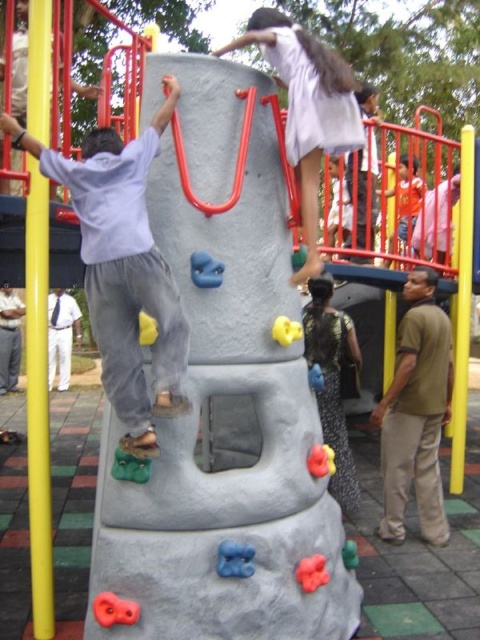
Question: Estimate the real-world distances between objects in this image. Which object is farther from the matte gray climbing wall at center?

Choices:
 (A) brown cotton shirt at right
 (B) brown leather shirt at lower left
 (C) white cotton pants at lower left
 (D) white matte dress at upper center

Answer: (C)

Question: Can you confirm if matte gray climbing wall at center is positioned to the right of white cotton pants at lower left?

Choices:
 (A) yes
 (B) no

Answer: (A)

Question: Which object is positioned farthest from the brown leather shirt at lower left?

Choices:
 (A) white matte dress at upper center
 (B) brown cotton shirt at right
 (C) white cotton pants at lower left

Answer: (A)

Question: Does matte gray climbing wall at center appear under white matte dress at upper center?

Choices:
 (A) yes
 (B) no

Answer: (A)

Question: Can you confirm if matte gray climbing wall at center is wider than brown leather shirt at lower left?

Choices:
 (A) no
 (B) yes

Answer: (B)

Question: Estimate the real-world distances between objects in this image. Which object is closer to the brown cotton shirt at right?

Choices:
 (A) white matte dress at upper center
 (B) brown leather shirt at lower left

Answer: (A)